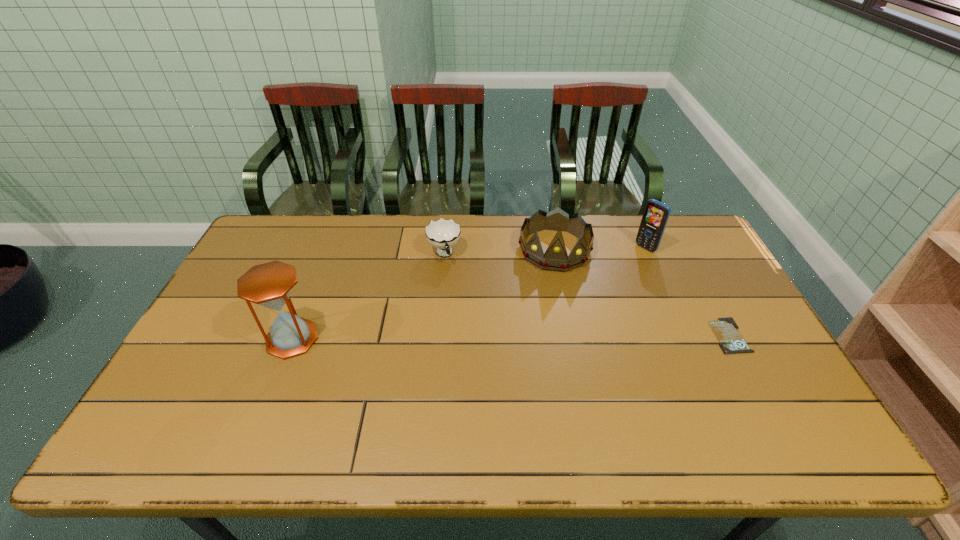
Where is `vacant area that lies between the shortest object and the tiara`? vacant area that lies between the shortest object and the tiara is located at coordinates coord(642,293).

Where is `free spot between the leftmost object and the rightmost object`? This screenshot has width=960, height=540. free spot between the leftmost object and the rightmost object is located at coordinates (511, 337).

The image size is (960, 540). In order to click on vacant area that lies between the fourth object from right to left and the cellular telephone in this screenshot , I will do `click(545, 251)`.

Locate an element on the screen. The width and height of the screenshot is (960, 540). vacant space in between the identity card and the tallest object is located at coordinates (511, 337).

Where is `vacant area that lies between the rightmost object and the third object from left to right`? vacant area that lies between the rightmost object and the third object from left to right is located at coordinates (642, 293).

Where is `vacant space in between the fourth object from left to right and the leftmost object`? vacant space in between the fourth object from left to right and the leftmost object is located at coordinates (468, 293).

This screenshot has height=540, width=960. Find the location of `vacant area that lies between the rightmost object and the hourglass`. vacant area that lies between the rightmost object and the hourglass is located at coordinates (511, 337).

You are a GUI agent. You are given a task and a screenshot of the screen. Output one action in this format:
    pyautogui.click(x=<x>, y=<y>)
    Task: Click on the empty location between the third object from right to left and the cellular telephone
    The width and height of the screenshot is (960, 540).
    Given the screenshot: What is the action you would take?
    pyautogui.click(x=600, y=248)

I want to click on free space between the rightmost object and the fourth object from left to right, so click(687, 292).

I want to click on empty location between the tiara and the cup, so click(x=499, y=252).